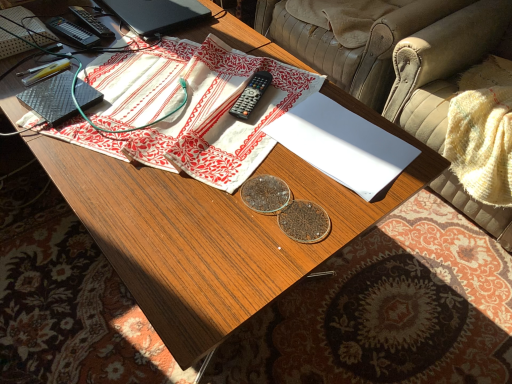
Locate an element on the screen. Image resolution: width=512 pixels, height=384 pixels. vacant space that is to the left of black plastic remote at center is located at coordinates (185, 96).